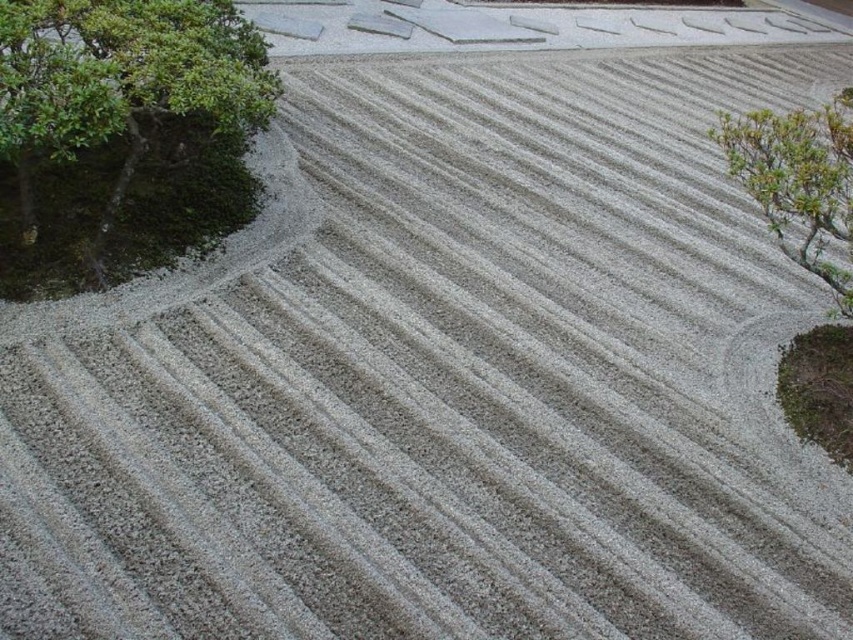
Question: Which point appears farthest from the camera in this image?

Choices:
 (A) (846, 150)
 (B) (132, 109)

Answer: (B)

Question: Which point is farther from the camera taking this photo?

Choices:
 (A) (809, 176)
 (B) (196, 241)

Answer: (B)

Question: Which object is farther from the camera taking this photo?

Choices:
 (A) green leafy bush at upper right
 (B) green leafy tree at upper left

Answer: (A)

Question: Is green leafy tree at upper left to the right of green leafy bush at upper right from the viewer's perspective?

Choices:
 (A) yes
 (B) no

Answer: (B)

Question: Is green leafy tree at upper left below green leafy bush at upper right?

Choices:
 (A) yes
 (B) no

Answer: (B)

Question: Can you confirm if green leafy tree at upper left is thinner than green leafy bush at upper right?

Choices:
 (A) yes
 (B) no

Answer: (B)